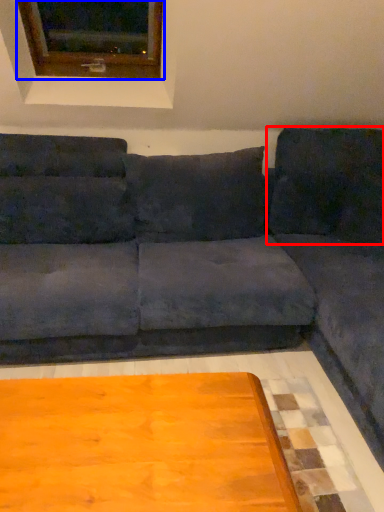
Question: Which object is closer to the camera taking this photo, pillow (highlighted by a red box) or window (highlighted by a blue box)?

Choices:
 (A) pillow
 (B) window

Answer: (B)